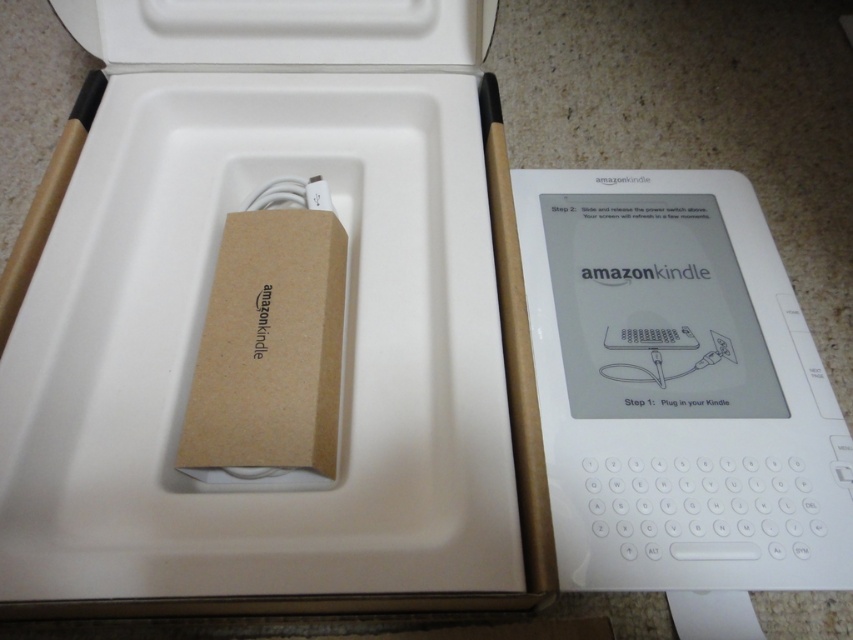
From the picture: Does brown/kraft paper amazonkindle at center have a larger size compared to white plastic kindle at right?

Indeed, brown/kraft paper amazonkindle at center has a larger size compared to white plastic kindle at right.

Which is in front, point (115, 243) or point (675, 352)?

Point (115, 243)

Who is more distant from viewer, (57, 456) or (779, 502)?

The point (779, 502) is behind.

I want to click on brown/kraft paper amazonkindle at center, so click(271, 323).